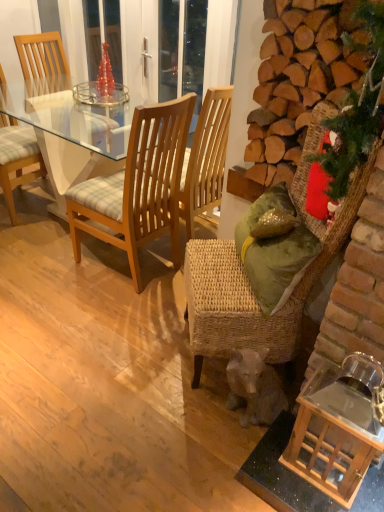
Question: Is green fabric christmas tree at right facing away from green fabric pillow at right?

Choices:
 (A) yes
 (B) no

Answer: (B)

Question: Considering the relative sizes of green fabric christmas tree at right and green fabric pillow at right in the image provided, is green fabric christmas tree at right bigger than green fabric pillow at right?

Choices:
 (A) yes
 (B) no

Answer: (B)

Question: From a real-world perspective, is green fabric christmas tree at right on top of green fabric pillow at right?

Choices:
 (A) yes
 (B) no

Answer: (A)

Question: Can you confirm if green fabric christmas tree at right is wider than green fabric pillow at right?

Choices:
 (A) no
 (B) yes

Answer: (A)

Question: Is there a large distance between green fabric christmas tree at right and green fabric pillow at right?

Choices:
 (A) yes
 (B) no

Answer: (B)

Question: Is woodenchair at left, positioned as the 3th chair in left-to-right order, wider or thinner than woven wicker chair at right, which is counted as the 4th chair, starting from the left?

Choices:
 (A) thin
 (B) wide

Answer: (A)

Question: From a real-world perspective, is woodenchair at left, acting as the second chair starting from the right, above or below woven wicker chair at right, which is counted as the 1th chair, starting from the right?

Choices:
 (A) above
 (B) below

Answer: (B)

Question: From the image's perspective, relative to woven wicker chair at right, which is counted as the 4th chair, starting from the left, is woodenchair at left, acting as the second chair starting from the right, above or below?

Choices:
 (A) above
 (B) below

Answer: (A)

Question: Choose the correct answer: Is woodenchair at left, acting as the second chair starting from the right, inside woven wicker chair at right, which is counted as the 1th chair, starting from the right, or outside it?

Choices:
 (A) outside
 (B) inside

Answer: (A)

Question: From the image's perspective, is light brown wooden chair at left, the second chair in the left-to-right sequence, above or below green fabric pillow at right?

Choices:
 (A) above
 (B) below

Answer: (A)

Question: Relative to green fabric pillow at right, is light brown wooden chair at left, the second chair in the left-to-right sequence, in front or behind?

Choices:
 (A) behind
 (B) front

Answer: (A)

Question: Looking at their shapes, would you say light brown wooden chair at left, the second chair in the left-to-right sequence, is wider or thinner than green fabric pillow at right?

Choices:
 (A) thin
 (B) wide

Answer: (B)

Question: From a real-world perspective, is light brown wooden chair at left, the second chair in the left-to-right sequence, positioned above or below green fabric pillow at right?

Choices:
 (A) above
 (B) below

Answer: (B)

Question: Is point (337, 194) closer or farther from the camera than point (170, 102)?

Choices:
 (A) closer
 (B) farther

Answer: (A)

Question: From the image's perspective, is green fabric christmas tree at right located above or below woodenchair at left, acting as the second chair starting from the right?

Choices:
 (A) above
 (B) below

Answer: (A)